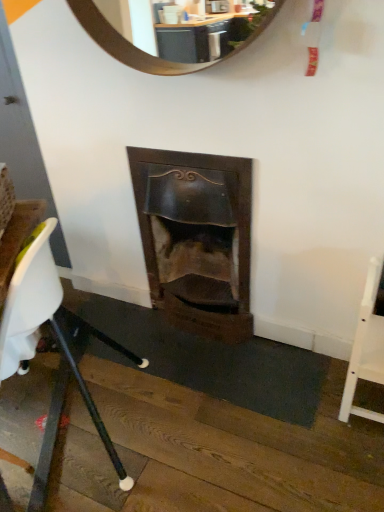
You are a GUI agent. You are given a task and a screenshot of the screen. Output one action in this format:
    pyautogui.click(x=<x>, y=<y>)
    Task: Click on the blank area beneath white plastic chair at lower left, which is the second chair in right-to-left order (from a real-world perspective)
    The height and width of the screenshot is (512, 384).
    Given the screenshot: What is the action you would take?
    pyautogui.click(x=61, y=415)